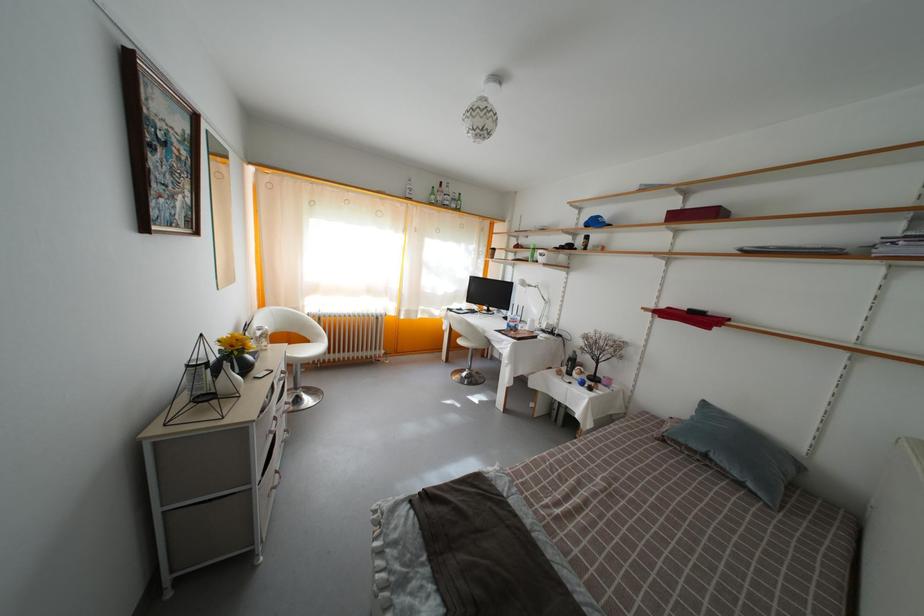
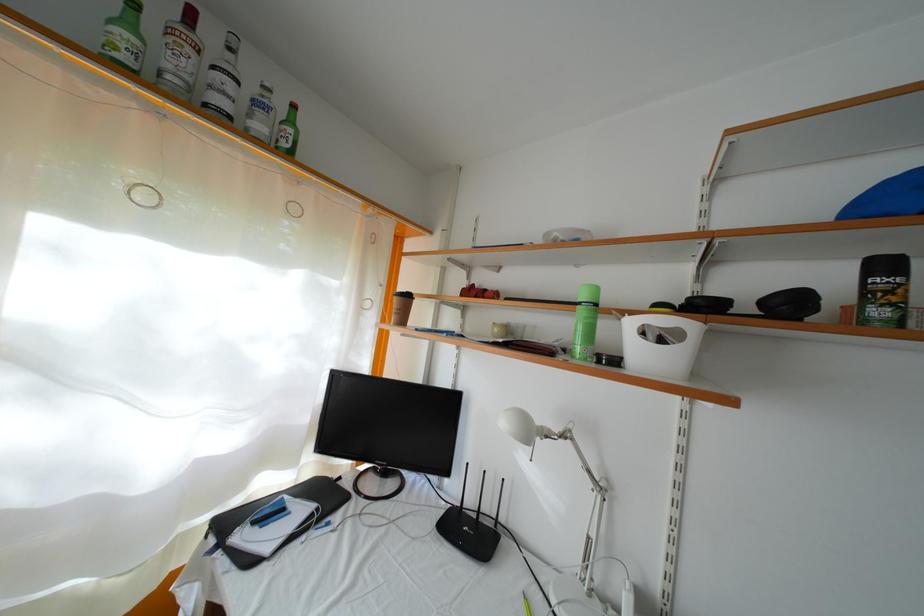
Locate, in the second image, the point that corresponds to the point at 439,200 in the first image.

(134, 31)